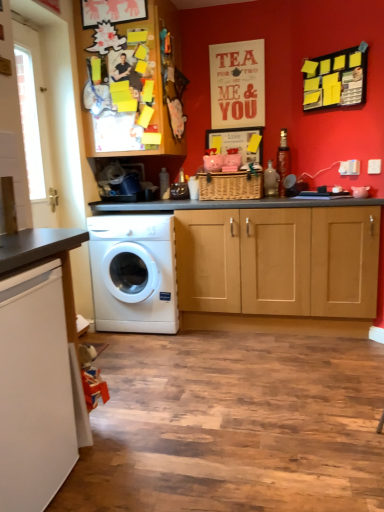
You are a GUI agent. You are given a task and a screenshot of the screen. Output one action in this format:
    pyautogui.click(x=<x>, y=<y>)
    Task: Click on the empty space that is ontop of yellow sticky notes on black board at upper right
    This screenshot has width=384, height=512.
    Given the screenshot: What is the action you would take?
    pyautogui.click(x=341, y=42)